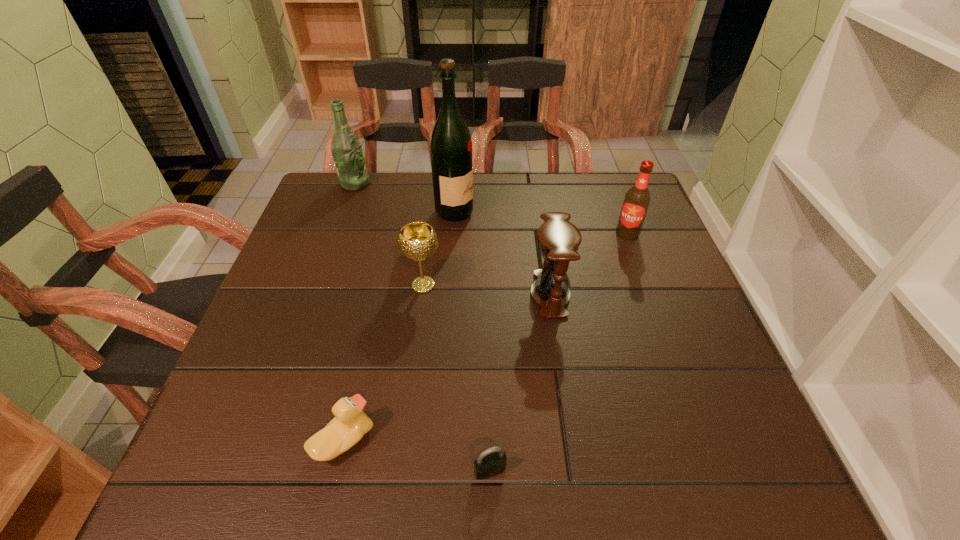
You are a GUI agent. You are given a task and a screenshot of the screen. Output one action in this format:
    pyautogui.click(x=<x>, y=<y>)
    Task: Click on the liquor
    The width and height of the screenshot is (960, 540).
    Given the screenshot: What is the action you would take?
    pyautogui.click(x=451, y=145)

The width and height of the screenshot is (960, 540). Identify the location of the tallest object. (451, 145).

The width and height of the screenshot is (960, 540). In order to click on the farthest object in this screenshot , I will do `click(346, 150)`.

You are a GUI agent. You are given a task and a screenshot of the screen. Output one action in this format:
    pyautogui.click(x=<x>, y=<y>)
    Task: Click on the leftmost object
    The image size is (960, 540).
    Given the screenshot: What is the action you would take?
    pyautogui.click(x=346, y=150)

Find the location of a particular element. the fifth nearest object is located at coordinates (637, 199).

The width and height of the screenshot is (960, 540). Identify the location of the rightmost object. (637, 199).

I want to click on the sixth object from left to right, so click(558, 240).

Locate an element on the screen. The image size is (960, 540). chalice is located at coordinates (417, 241).

Identify the location of the sixth tallest object. The height and width of the screenshot is (540, 960). (350, 424).

Identify the location of the sixth object from right to left. (350, 424).